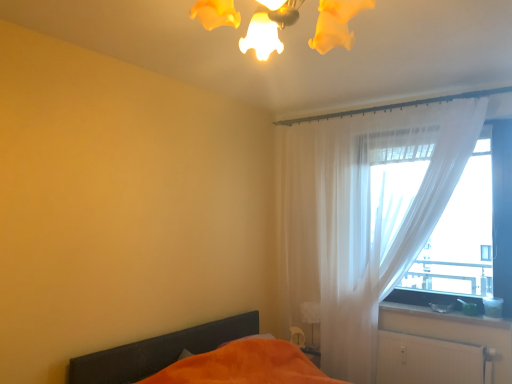
Question: Which is correct: orange fabric bed at lower left is inside white glossy table lamp at lower right, or outside of it?

Choices:
 (A) outside
 (B) inside

Answer: (A)

Question: From a real-world perspective, is orange fabric bed at lower left physically located above or below white glossy table lamp at lower right?

Choices:
 (A) above
 (B) below

Answer: (B)

Question: Which is farther from the smooth white surface at lower right?

Choices:
 (A) white textured radiator at lower right
 (B) white glossy table lamp at lower right
 (C) matte yellow lampshade at upper center
 (D) sheer white curtain at right
 (E) translucent fabric at right

Answer: (C)

Question: Which is nearer to the matte yellow lampshade at upper center?

Choices:
 (A) white glossy table lamp at lower right
 (B) smooth white surface at lower right
 (C) orange fabric bed at lower left
 (D) white textured radiator at lower right
 (E) translucent fabric at right

Answer: (C)